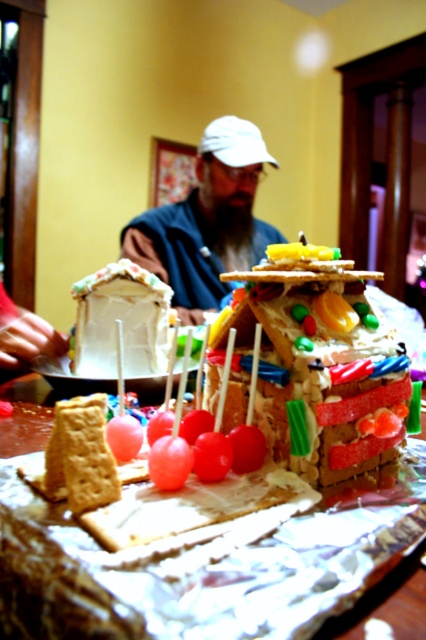
You are a guest at a holiday party and see the festive gingerbread house on the table. You notice two items at the center of the image, the shiny aluminum foil at center and the matte white cap at center. Which one is positioned lower?

The shiny aluminum foil at center is below the matte white cap at center, so the shiny aluminum foil at center is positioned lower.

You are a guest at a holiday party and see the white fondant house at center and the matte brown gingerbread at lower left on the table. Which one is larger?

The white fondant house at center is bigger than the matte brown gingerbread at lower left.